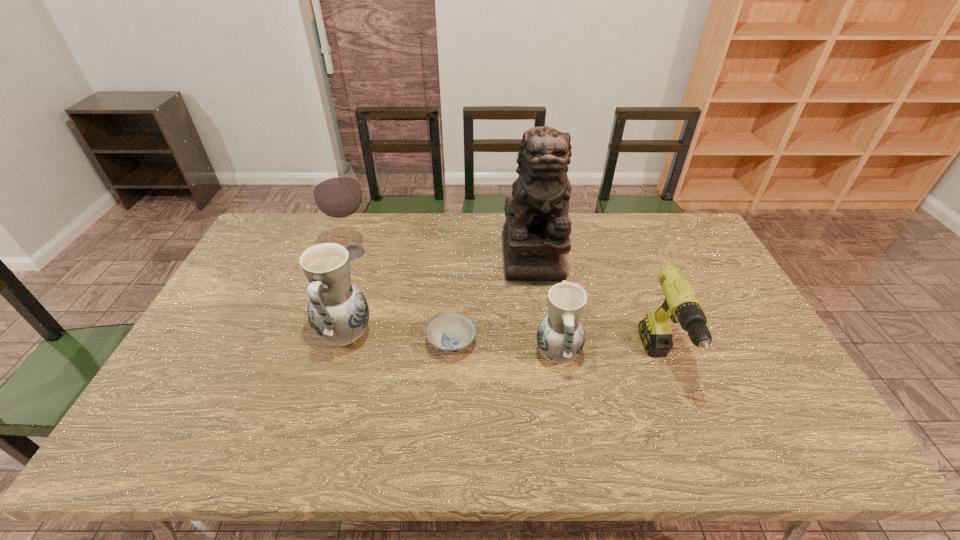
Where is `free space for a new pottery on the right`? free space for a new pottery on the right is located at coordinates (789, 377).